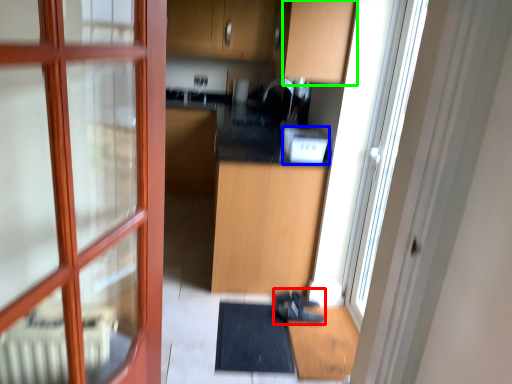
Question: Which object is the closest to the shoe (highlighted by a red box)? Choose among these: appliance (highlighted by a blue box) or cabinetry (highlighted by a green box).

Choices:
 (A) appliance
 (B) cabinetry

Answer: (A)